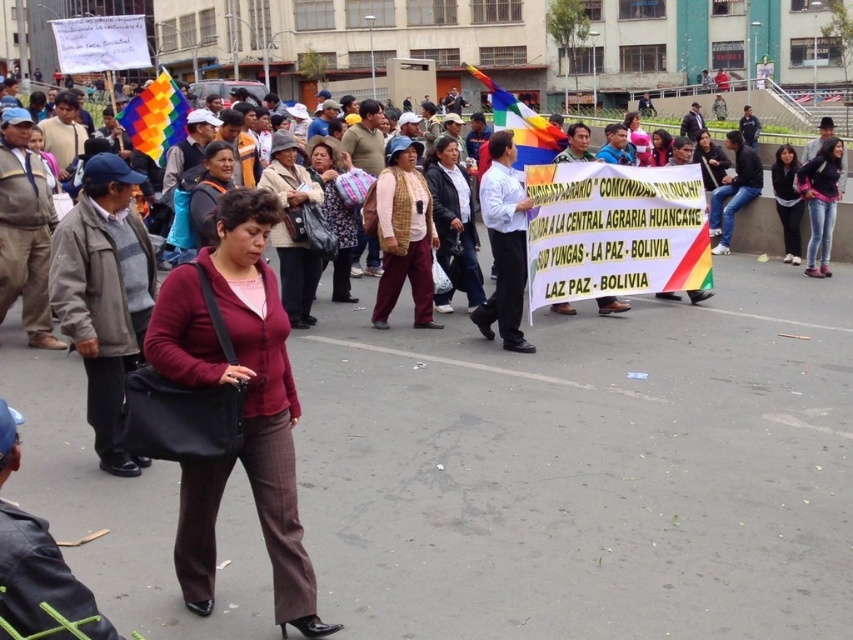
Is rainbow fabric kite at upper left closer to the viewer compared to knitted sweater at center?

No, it is behind knitted sweater at center.

Can you confirm if rainbow fabric kite at upper left is shorter than knitted sweater at center?

Indeed, rainbow fabric kite at upper left has a lesser height compared to knitted sweater at center.

Is point (154, 125) closer to viewer compared to point (334, 296)?

No, (154, 125) is behind (334, 296).

This screenshot has width=853, height=640. Identify the location of rainbow fabric kite at upper left. (155, 116).

What do you see at coordinates (155, 116) in the screenshot?
I see `rainbow fabric kite at upper left` at bounding box center [155, 116].

Between rainbow fabric kite at upper left and rainbow fabric flag at center, which one has less height?

With less height is rainbow fabric kite at upper left.

Image resolution: width=853 pixels, height=640 pixels. What are the coordinates of `rainbow fabric kite at upper left` in the screenshot? It's located at (155, 116).

Which is behind, point (231, 371) or point (820, 182)?

The point (820, 182) is behind.

Can you confirm if matte maroon sweater at center is positioned to the right of jeans at center?

In fact, matte maroon sweater at center is to the left of jeans at center.

In order to click on matte maroon sweater at center in this screenshot , I will do `click(241, 404)`.